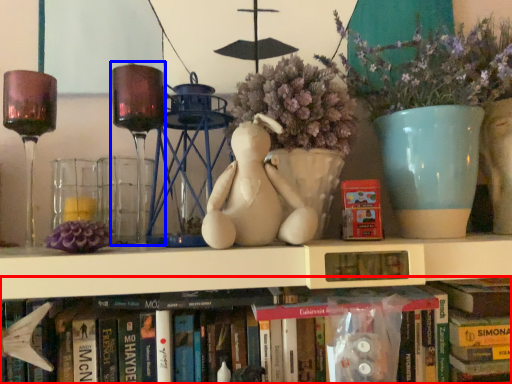
Question: Which object appears closest to the camera in this image, book (highlighted by a red box) or candle holder (highlighted by a blue box)?

Choices:
 (A) book
 (B) candle holder

Answer: (B)